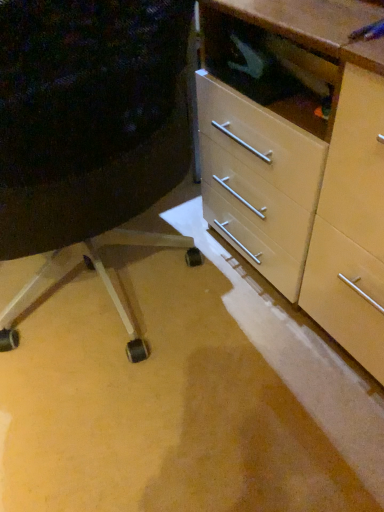
Question: Is matte wood chest of drawers at center positioned behind matte plastic drawer at center-right?

Choices:
 (A) yes
 (B) no

Answer: (A)

Question: Can you confirm if matte wood chest of drawers at center is wider than matte plastic drawer at center-right?

Choices:
 (A) no
 (B) yes

Answer: (A)

Question: Can you confirm if matte wood chest of drawers at center is thinner than matte plastic drawer at center-right?

Choices:
 (A) yes
 (B) no

Answer: (A)

Question: Is matte wood chest of drawers at center to the left of matte plastic drawer at center-right from the viewer's perspective?

Choices:
 (A) yes
 (B) no

Answer: (B)

Question: Could you tell me if matte wood chest of drawers at center is turned towards matte plastic drawer at center-right?

Choices:
 (A) no
 (B) yes

Answer: (B)

Question: From the image's perspective, would you say matte wood chest of drawers at center is positioned over matte plastic drawer at center-right?

Choices:
 (A) yes
 (B) no

Answer: (A)

Question: From a real-world perspective, is matte plastic drawer at center-right on matte wood chest of drawers at center?

Choices:
 (A) no
 (B) yes

Answer: (B)

Question: Considering the relative sizes of matte plastic drawer at center-right and matte wood chest of drawers at center in the image provided, is matte plastic drawer at center-right shorter than matte wood chest of drawers at center?

Choices:
 (A) yes
 (B) no

Answer: (B)

Question: Could you tell me if matte plastic drawer at center-right is turned towards matte wood chest of drawers at center?

Choices:
 (A) yes
 (B) no

Answer: (B)

Question: Is matte wood chest of drawers at center at the back of matte plastic drawer at center-right?

Choices:
 (A) no
 (B) yes

Answer: (A)

Question: Considering the relative positions of matte plastic drawer at center-right and matte wood chest of drawers at center in the image provided, is matte plastic drawer at center-right to the right of matte wood chest of drawers at center from the viewer's perspective?

Choices:
 (A) no
 (B) yes

Answer: (A)

Question: Considering the relative sizes of matte plastic drawer at center-right and matte wood chest of drawers at center in the image provided, is matte plastic drawer at center-right thinner than matte wood chest of drawers at center?

Choices:
 (A) no
 (B) yes

Answer: (A)

Question: Is point (102, 65) closer or farther from the camera than point (380, 360)?

Choices:
 (A) closer
 (B) farther

Answer: (A)